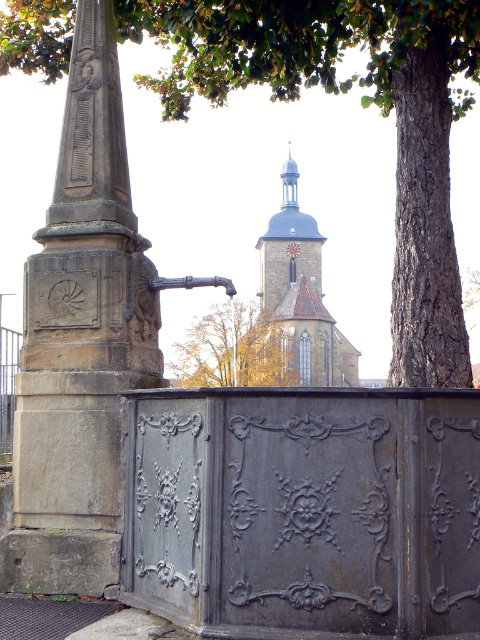
In the scene shown: Between rustic stone fountain at left and yellow autumn leaves at center, which one appears on the left side from the viewer's perspective?

Positioned to the left is rustic stone fountain at left.

Image resolution: width=480 pixels, height=640 pixels. What do you see at coordinates (81, 339) in the screenshot? I see `rustic stone fountain at left` at bounding box center [81, 339].

You are a GUI agent. You are given a task and a screenshot of the screen. Output one action in this format:
    pyautogui.click(x=<x>, y=<y>)
    Task: Click on the rustic stone fountain at left
    This screenshot has height=640, width=480.
    Given the screenshot: What is the action you would take?
    pyautogui.click(x=81, y=339)

Can you confirm if rustic stone fountain at left is positioned above smooth gray stone tower at center?

Actually, rustic stone fountain at left is below smooth gray stone tower at center.

Is point (35, 570) positioned in front of point (285, 252)?

Yes, point (35, 570) is closer to viewer.

At what (x,y) coordinates should I click in order to perform the action: click on rustic stone fountain at left. Please return your answer as a coordinate pair (x, y). This screenshot has width=480, height=640. Looking at the image, I should click on (81, 339).

How much distance is there between brown textured tree at upper right and yellow autumn leaves at center?

A distance of 29.86 meters exists between brown textured tree at upper right and yellow autumn leaves at center.

Locate an element on the screen. brown textured tree at upper right is located at coordinates (363, 106).